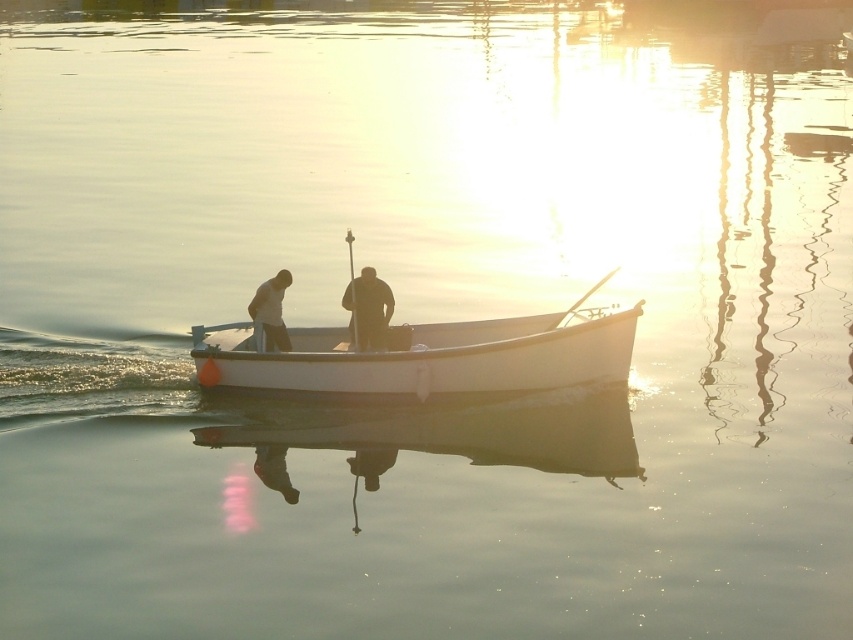
Question: Considering the real-world distances, which object is farthest from the smooth white shirt at center?

Choices:
 (A) white matte canoe at center
 (B) dark brown leather jacket at center

Answer: (A)

Question: Which of the following is the farthest from the observer?

Choices:
 (A) dark brown leather jacket at center
 (B) smooth white shirt at center

Answer: (B)

Question: Is dark brown leather jacket at center smaller than smooth white shirt at center?

Choices:
 (A) yes
 (B) no

Answer: (A)

Question: Which point appears farthest from the camera in this image?

Choices:
 (A) (527, 333)
 (B) (277, 301)
 (C) (378, 296)

Answer: (A)

Question: In this image, where is white matte canoe at center located relative to smooth white shirt at center?

Choices:
 (A) right
 (B) left

Answer: (A)

Question: Can you confirm if white matte canoe at center is positioned above smooth white shirt at center?

Choices:
 (A) yes
 (B) no

Answer: (B)